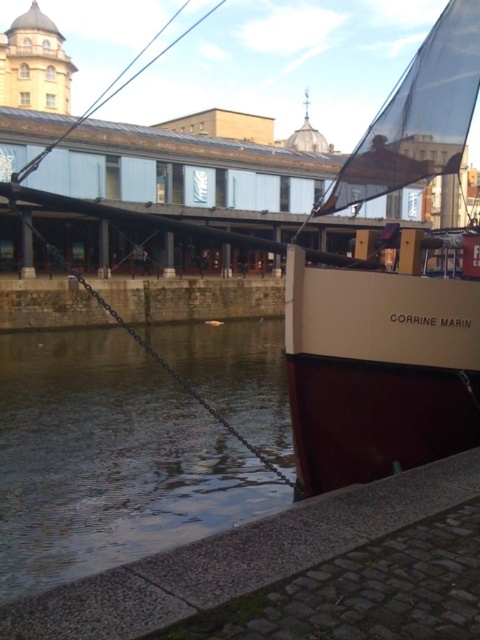
Question: Is smooth water at lower left behind beige matte sailboat at right?

Choices:
 (A) yes
 (B) no

Answer: (B)

Question: Does smooth water at lower left have a lesser width compared to beige matte sailboat at right?

Choices:
 (A) yes
 (B) no

Answer: (B)

Question: Which object appears farthest from the camera in this image?

Choices:
 (A) smooth water at lower left
 (B) beige matte sailboat at right

Answer: (B)

Question: Can you confirm if smooth water at lower left is smaller than beige matte sailboat at right?

Choices:
 (A) yes
 (B) no

Answer: (B)

Question: Among these objects, which one is farthest from the camera?

Choices:
 (A) smooth water at lower left
 (B) beige matte sailboat at right

Answer: (B)